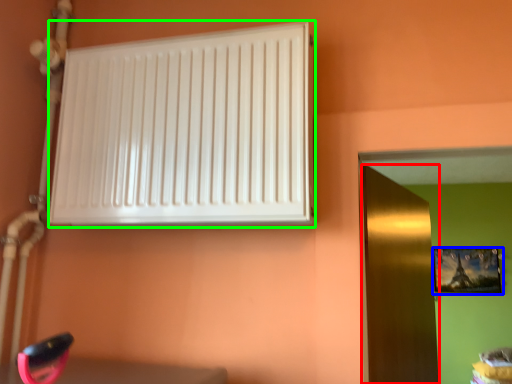
Question: Based on their relative distances, which object is nearer to door (highlighted by a red box)? Choose from picture frame (highlighted by a blue box) and radiator (highlighted by a green box).

Choices:
 (A) picture frame
 (B) radiator

Answer: (B)